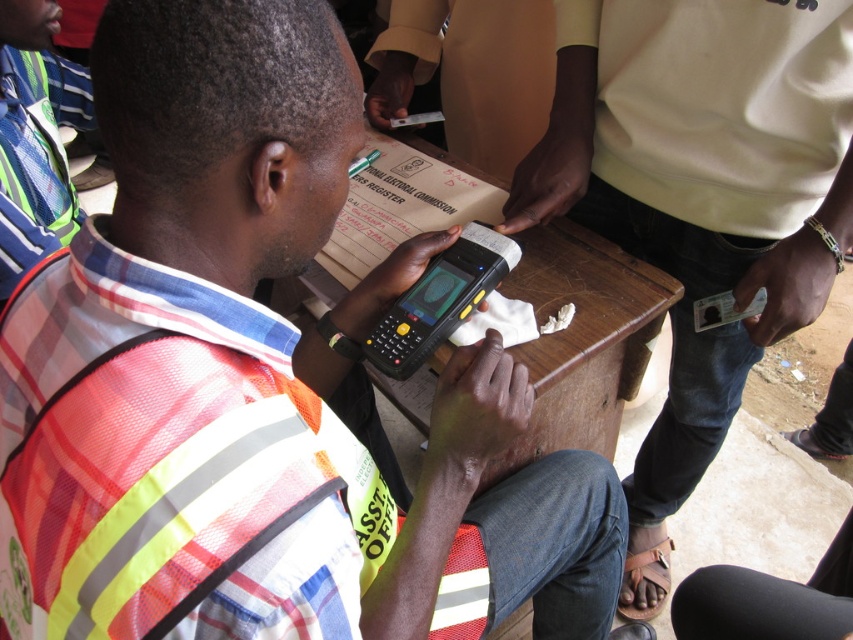
Question: Considering the relative positions of reflective orange vest at center and wooden table at center in the image provided, where is reflective orange vest at center located with respect to wooden table at center?

Choices:
 (A) left
 (B) right

Answer: (A)

Question: Is reflective orange vest at center thinner than reflective safety vest at center?

Choices:
 (A) yes
 (B) no

Answer: (B)

Question: Does reflective safety vest at center come behind wooden table at center?

Choices:
 (A) yes
 (B) no

Answer: (A)

Question: Estimate the real-world distances between objects in this image. Which object is farther from the reflective orange vest at center?

Choices:
 (A) reflective safety vest at center
 (B) wooden table at center

Answer: (A)

Question: Which point appears farthest from the camera in this image?

Choices:
 (A) (265, 81)
 (B) (408, 232)
 (C) (610, 38)

Answer: (C)

Question: Which object is the farthest from the wooden table at center?

Choices:
 (A) reflective orange vest at center
 (B) reflective safety vest at center

Answer: (A)